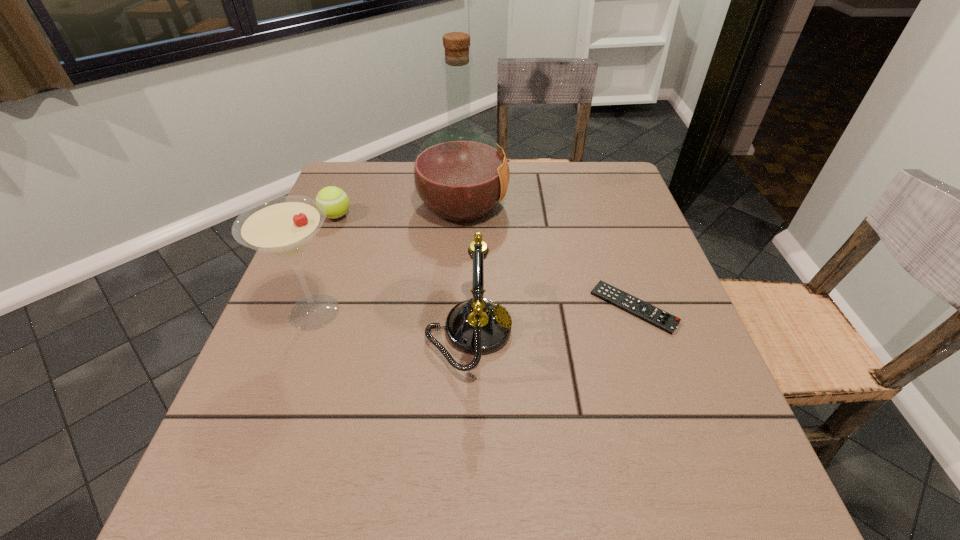
Image resolution: width=960 pixels, height=540 pixels. Find the location of `free spot between the third tallest object and the tennis ball`. free spot between the third tallest object and the tennis ball is located at coordinates (402, 274).

At what (x,y) coordinates should I click in order to perform the action: click on free spot between the martini and the liquor. Please return your answer as a coordinate pair (x, y). This screenshot has width=960, height=540. Looking at the image, I should click on coord(388,259).

I want to click on free space between the rightmost object and the telephone, so click(551, 320).

Identify the location of the second closest object relative to the second tallest object. Image resolution: width=960 pixels, height=540 pixels. (460, 174).

Select which object appears as the second closest to the second tallest object. Please provide its 2D coordinates. Your answer should be formatted as a tuple, i.e. [(x, y)], where the tuple contains the x and y coordinates of a point satisfying the conditions above.

[(460, 174)]

At what (x,y) coordinates should I click in order to perform the action: click on vacant region that satisfies the following two spatial constraints: 1. on the back side of the rightmost object; 2. on the front label of the tallest object. Please return your answer as a coordinate pair (x, y). Looking at the image, I should click on (599, 206).

Locate an element on the screen. vacant space that satisfies the following two spatial constraints: 1. on the front label of the tallest object; 2. on the front side of the fourth shortest object is located at coordinates coord(457,312).

At what (x,y) coordinates should I click in order to perform the action: click on free spot that satisfies the following two spatial constraints: 1. on the front label of the tallest object; 2. on the back side of the remote control. Please return your answer as a coordinate pair (x, y). Image resolution: width=960 pixels, height=540 pixels. Looking at the image, I should click on (457, 308).